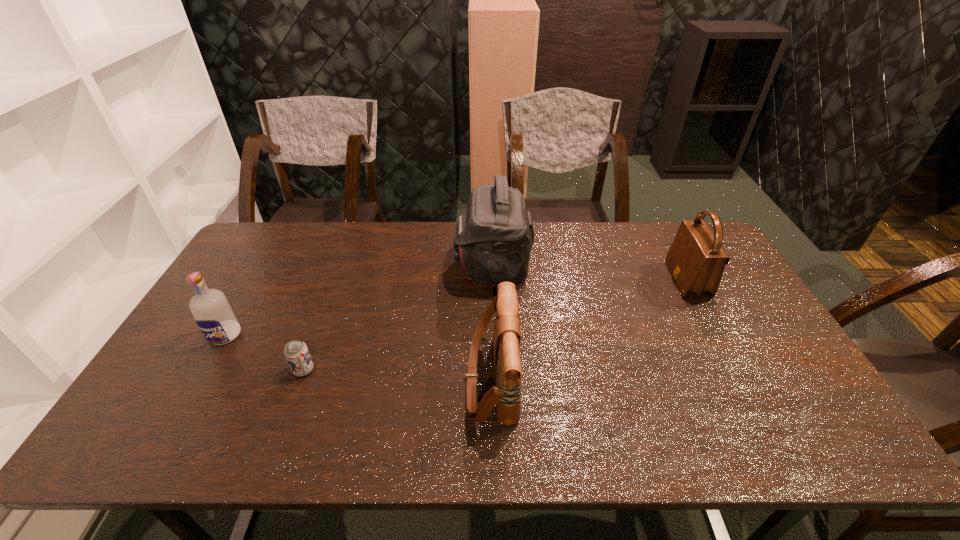
Find the location of `vacant region between the second object from left to right and the tallest shoulder bag`. vacant region between the second object from left to right and the tallest shoulder bag is located at coordinates (397, 319).

Locate an element on the screen. The width and height of the screenshot is (960, 540). free space between the second object from left to right and the nearest shoulder bag is located at coordinates (397, 375).

Where is `free spot between the rightmost shoulder bag and the vodka`? The width and height of the screenshot is (960, 540). free spot between the rightmost shoulder bag and the vodka is located at coordinates (456, 307).

The width and height of the screenshot is (960, 540). I want to click on vacant space in between the fourth object from right to left and the tallest shoulder bag, so click(397, 319).

This screenshot has width=960, height=540. Identify the location of free space between the rightmost shoulder bag and the nearest shoulder bag. (589, 329).

Where is `vacant area between the rightmost object and the leftmost object`? vacant area between the rightmost object and the leftmost object is located at coordinates (456, 307).

This screenshot has width=960, height=540. Find the location of `object that is the fourth closest to the nearest shoulder bag`. object that is the fourth closest to the nearest shoulder bag is located at coordinates (213, 314).

Locate which object ranks in proximity to the tallest object. Please provide its 2D coordinates. Your answer should be formatted as a tuple, i.e. [(x, y)], where the tuple contains the x and y coordinates of a point satisfying the conditions above.

[(506, 395)]

Find the location of a particular element. The image size is (960, 540). shoulder bag that stands as the second closest to the shortest object is located at coordinates (493, 238).

The image size is (960, 540). I want to click on shoulder bag that is the nearest to the tallest object, so click(506, 395).